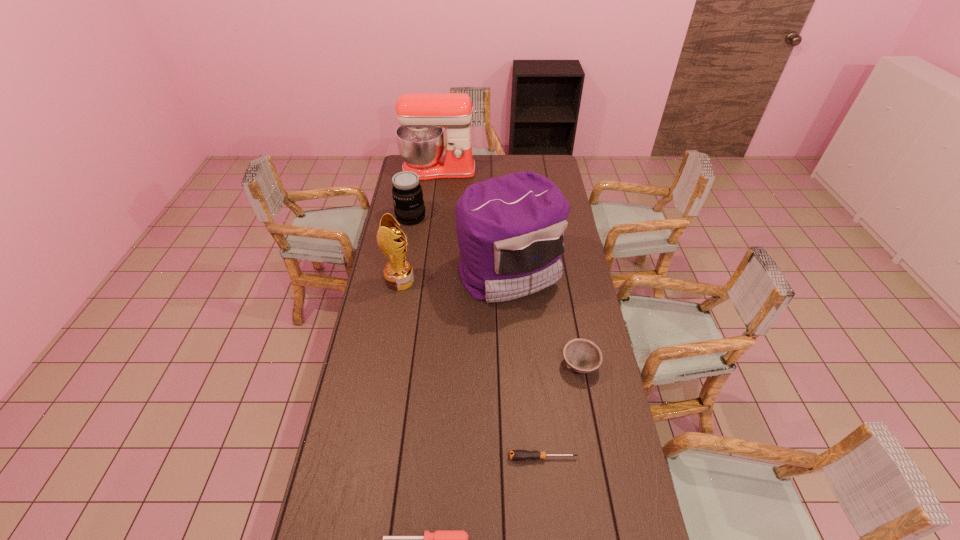
The image size is (960, 540). I want to click on screwdriver that is the second closest to the backpack, so point(441,539).

Locate an element on the screen. screwdriver that can be found as the closest to the award is located at coordinates (520, 455).

Where is `free spot that satisfies the following two spatial constraints: 1. on the front-facing side of the mixer; 2. on the front-facing side of the fifth shortest object`? This screenshot has width=960, height=540. free spot that satisfies the following two spatial constraints: 1. on the front-facing side of the mixer; 2. on the front-facing side of the fifth shortest object is located at coordinates (424, 281).

Locate an element on the screen. This screenshot has width=960, height=540. free region that satisfies the following two spatial constraints: 1. on the front pocket of the backpack; 2. on the front-facing side of the fifth shortest object is located at coordinates pyautogui.click(x=510, y=281).

At what (x,y) coordinates should I click in order to perform the action: click on vacant area in the image that satisfies the following two spatial constraints: 1. on the front pocket of the right screwdriver; 2. on the left side of the backpack. Please return your answer as a coordinate pair (x, y). The width and height of the screenshot is (960, 540). Looking at the image, I should click on (x=522, y=457).

Identify the location of vacant space that satisfies the following two spatial constraints: 1. on the back side of the bowl; 2. on the front-facing side of the award. (564, 281).

This screenshot has height=540, width=960. I want to click on free region that satisfies the following two spatial constraints: 1. on the front-facing side of the second nearest object; 2. on the right side of the fifth shortest object, so click(368, 457).